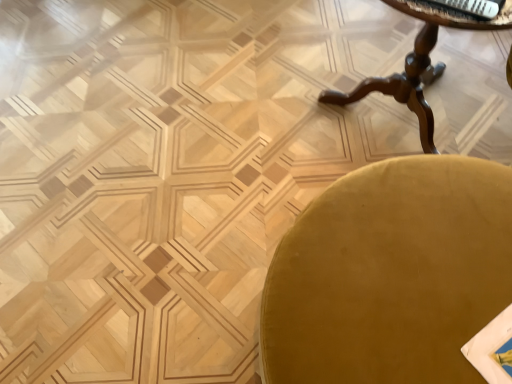
Question: Is mahogany wood table at upper right in front of velvet gold chair at lower right?

Choices:
 (A) no
 (B) yes

Answer: (A)

Question: Does mahogany wood table at upper right have a smaller size compared to velvet gold chair at lower right?

Choices:
 (A) yes
 (B) no

Answer: (B)

Question: From a real-world perspective, is mahogany wood table at upper right located beneath velvet gold chair at lower right?

Choices:
 (A) yes
 (B) no

Answer: (B)

Question: Can you confirm if mahogany wood table at upper right is wider than velvet gold chair at lower right?

Choices:
 (A) yes
 (B) no

Answer: (B)

Question: From the image's perspective, is mahogany wood table at upper right under velvet gold chair at lower right?

Choices:
 (A) yes
 (B) no

Answer: (B)

Question: Would you say white glossy magazine at upper right is to the left or to the right of velvet gold chair at lower right in the picture?

Choices:
 (A) right
 (B) left

Answer: (A)

Question: From the image's perspective, is white glossy magazine at upper right positioned above or below velvet gold chair at lower right?

Choices:
 (A) below
 (B) above

Answer: (B)

Question: From a real-world perspective, relative to velvet gold chair at lower right, is white glossy magazine at upper right vertically above or below?

Choices:
 (A) below
 (B) above

Answer: (B)

Question: Considering the positions of point (486, 0) and point (340, 324), is point (486, 0) closer or farther from the camera than point (340, 324)?

Choices:
 (A) farther
 (B) closer

Answer: (A)

Question: From a real-world perspective, is mahogany wood table at upper right physically located above or below white glossy magazine at upper right?

Choices:
 (A) below
 (B) above

Answer: (A)

Question: Is mahogany wood table at upper right inside or outside of white glossy magazine at upper right?

Choices:
 (A) outside
 (B) inside

Answer: (A)

Question: Does point (421, 130) appear closer or farther from the camera than point (499, 11)?

Choices:
 (A) closer
 (B) farther

Answer: (B)

Question: From the image's perspective, is mahogany wood table at upper right above or below white glossy magazine at upper right?

Choices:
 (A) above
 (B) below

Answer: (A)

Question: Is white glossy magazine at upper right to the left or to the right of mahogany wood table at upper right in the image?

Choices:
 (A) left
 (B) right

Answer: (A)

Question: Would you say white glossy magazine at upper right is inside or outside mahogany wood table at upper right?

Choices:
 (A) outside
 (B) inside

Answer: (B)